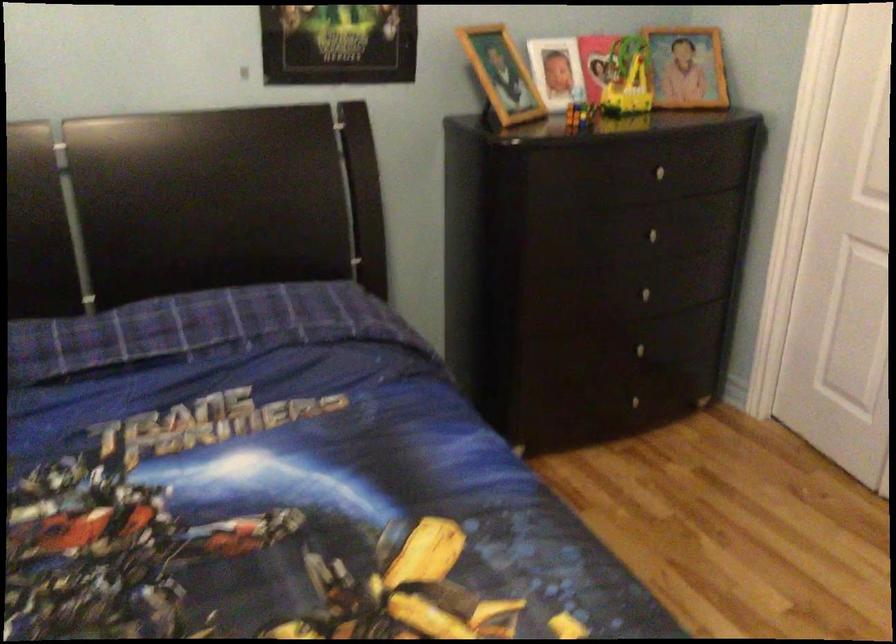
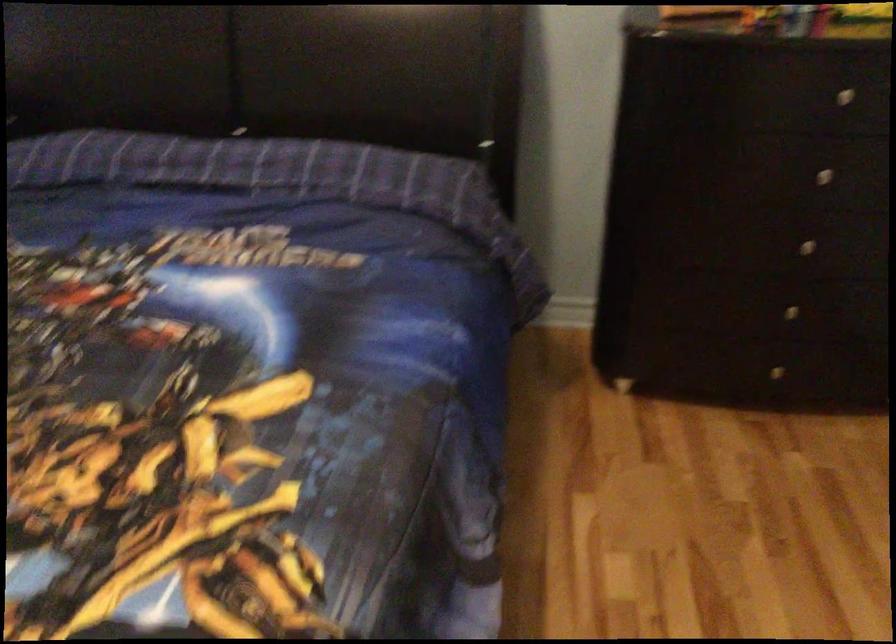
In the second image, find the point that corresponds to [645,346] in the first image.

(790, 310)